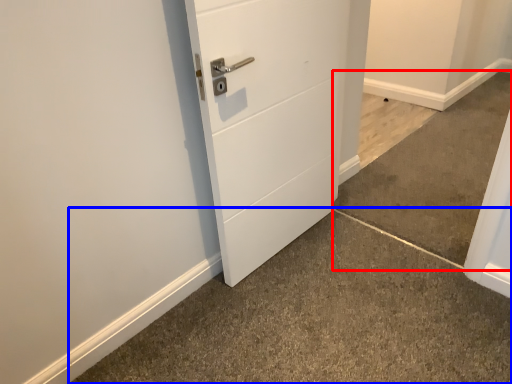
Question: Which point is further to the camera, concrete (highlighted by a red box) or concrete (highlighted by a blue box)?

Choices:
 (A) concrete
 (B) concrete

Answer: (A)